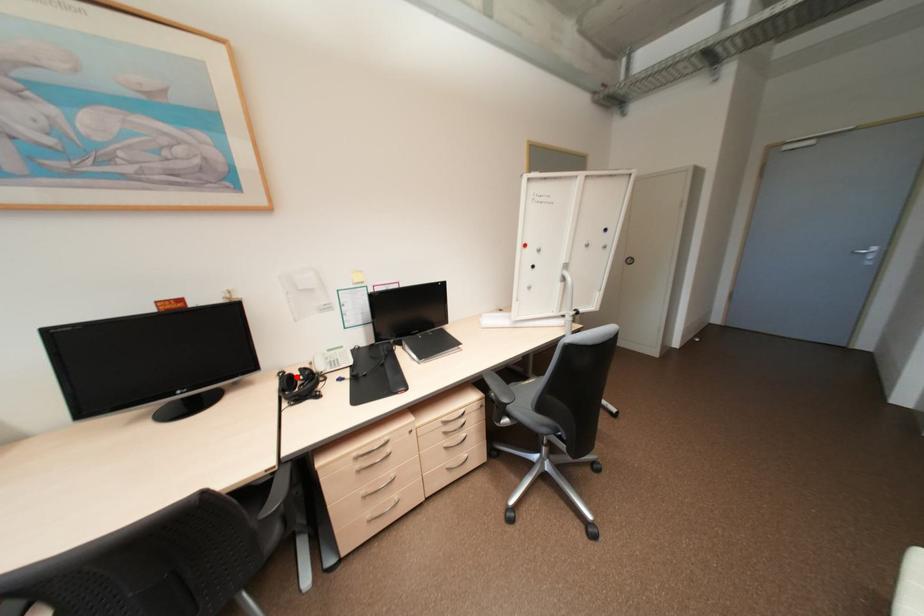
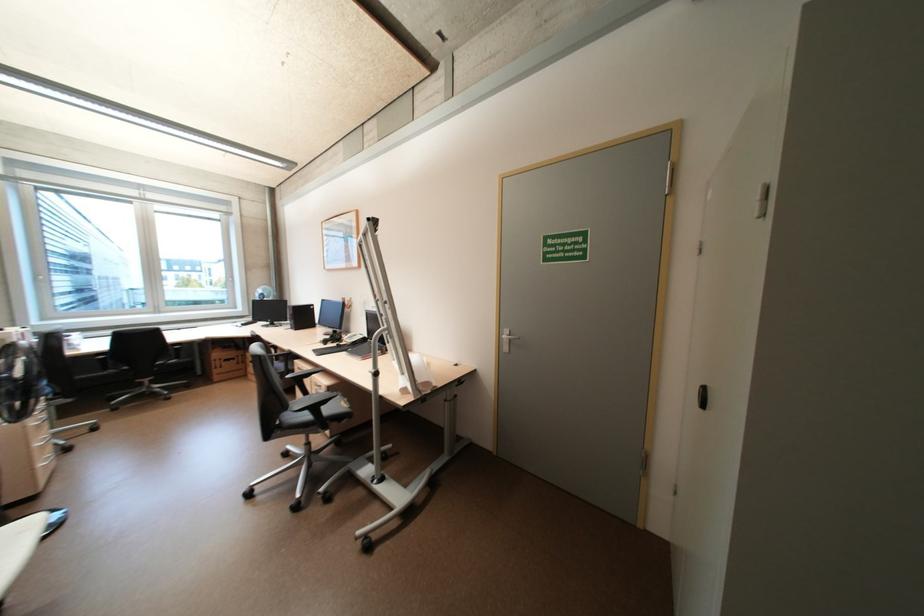
Question: I am providing you with two images of the same scene from different viewpoints. A red point is marked on the first image. Can you still see the location of the red point in image 2?

Choices:
 (A) Yes
 (B) No

Answer: (B)